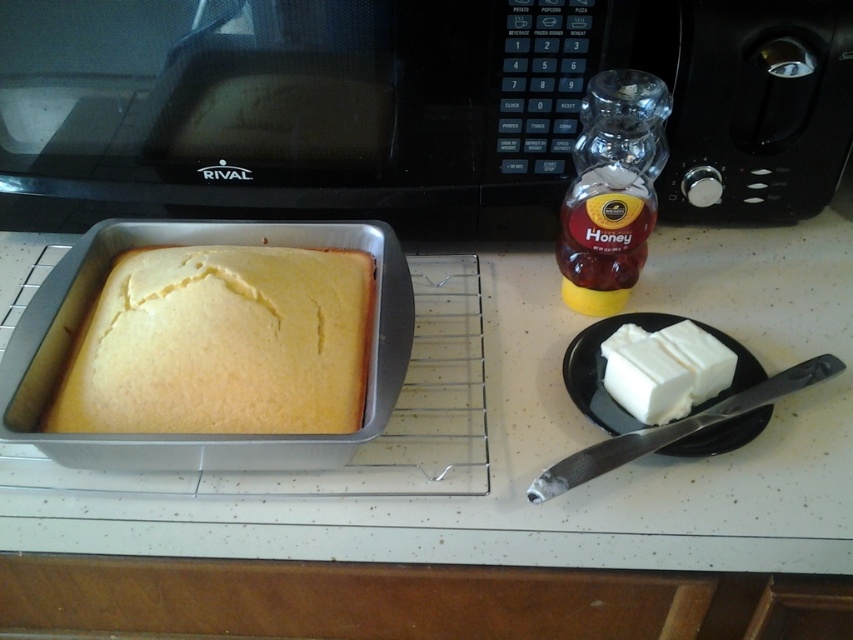
You are organizing the kitchen and need to place a new spice jar on the countertop. The black plastic microwave at upper center is currently occupying some space. Where should you place the spice jar to avoid the microwave?

The black plastic microwave at upper center is located at point (405, 108), so you should place the spice jar in an area of the countertop that does not overlap with this coordinate to avoid the microwave.

You are preparing to serve the cake and need to place both the yellow matte cake at center and the translucent glass honey jar at right on a shelf. The shelf has limited vertical space. Which item should you place first to ensure both fit without exceeding the shelf height?

You should place the translucent glass honey jar at right first because the yellow matte cake at center has a lesser height, so placing the taller honey jar first allows the shorter cake to be placed on top or alongside without exceeding the shelf height.

You are trying to place the yellow matte cake at center onto the black plastic microwave at upper center. Based on their sizes, will the cake fit on the microwave without overhanging?

The black plastic microwave at upper center might be wider than yellow matte cake at center, so there is a possibility that the cake will fit without overhanging. However, the exact dimensions are uncertain as the description only states that the microwave might be wider.